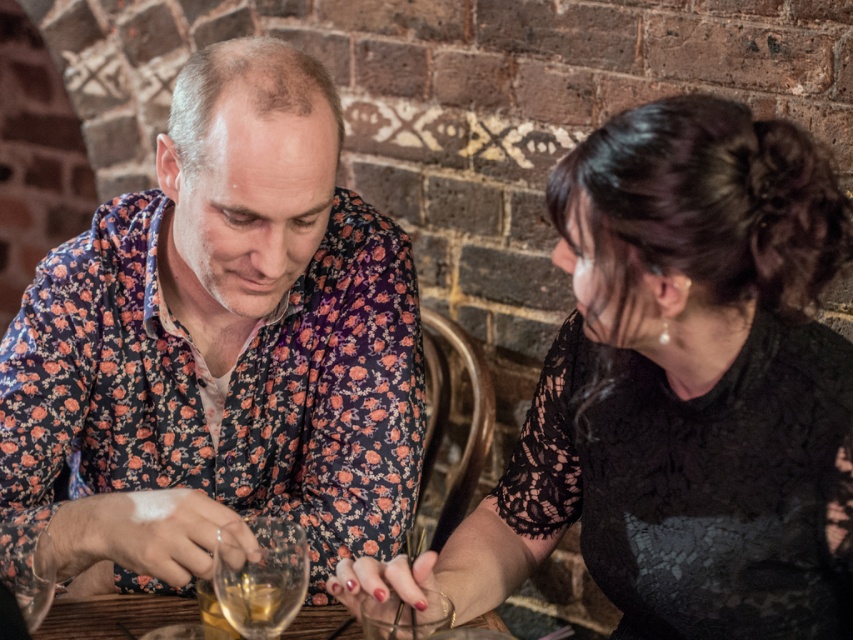
Question: Is black lace dress at center wider than clear glass at lower center?

Choices:
 (A) no
 (B) yes

Answer: (B)

Question: Which of the following is the closest to the observer?

Choices:
 (A) (253, 179)
 (B) (322, 608)
 (C) (753, 291)
 (D) (227, 611)

Answer: (D)

Question: Does floral-patterned shirt at center appear over black lace dress at center?

Choices:
 (A) no
 (B) yes

Answer: (B)

Question: Which of the following is the closest to the observer?

Choices:
 (A) (28, 323)
 (B) (579, 170)
 (C) (283, 554)
 (D) (90, 621)

Answer: (B)

Question: Does clear glass at lower center appear on the left side of wooden table at center?

Choices:
 (A) no
 (B) yes

Answer: (B)

Question: Estimate the real-world distances between objects in this image. Which object is farther from the wooden table at center?

Choices:
 (A) black lace dress at center
 (B) clear glass at lower center
 (C) floral-patterned shirt at center

Answer: (A)